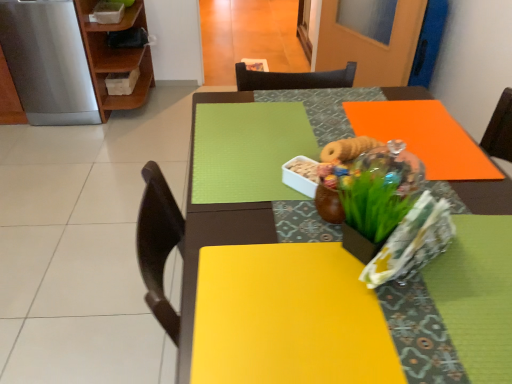
Where is `vacant space to the left of green matte floral arrangement at center`? This screenshot has height=384, width=512. vacant space to the left of green matte floral arrangement at center is located at coordinates (275, 226).